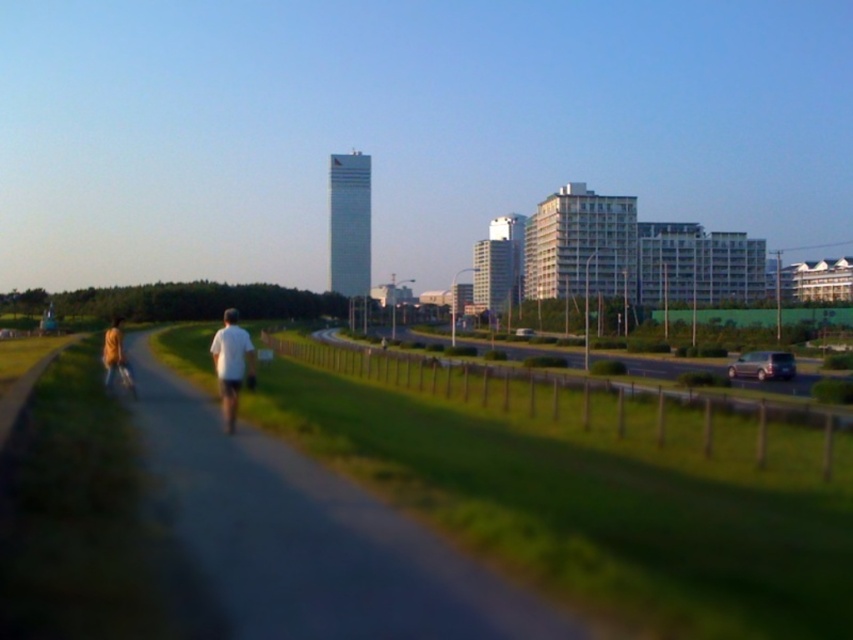
Question: Does gray asphalt path at center appear on the left side of white matte shirt at center?

Choices:
 (A) no
 (B) yes

Answer: (A)

Question: Which point is farther to the camera?

Choices:
 (A) (260, 580)
 (B) (225, 323)

Answer: (B)

Question: Does gray asphalt path at center have a greater width compared to white matte shirt at center?

Choices:
 (A) no
 (B) yes

Answer: (B)

Question: Does gray asphalt path at center appear under white matte shirt at center?

Choices:
 (A) no
 (B) yes

Answer: (B)

Question: Which object appears farthest from the camera in this image?

Choices:
 (A) white matte shirt at center
 (B) gray asphalt path at center

Answer: (A)

Question: Which point appears closest to the camera in this image?

Choices:
 (A) [366, 493]
 (B) [250, 360]

Answer: (A)